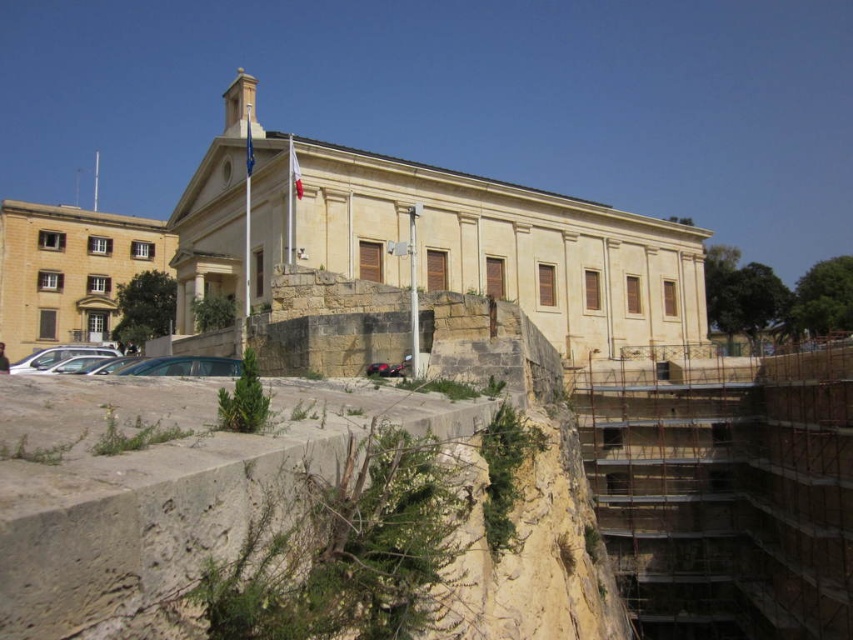
Is metallic silver car at lower left bigger than silver metallic car at lower left?

Incorrect, metallic silver car at lower left is not larger than silver metallic car at lower left.

Can you confirm if metallic silver car at lower left is shorter than silver metallic car at lower left?

Yes, metallic silver car at lower left is shorter than silver metallic car at lower left.

Which is in front, point (175, 365) or point (28, 355)?

Point (175, 365)

I want to click on metallic silver car at lower left, so pos(183,365).